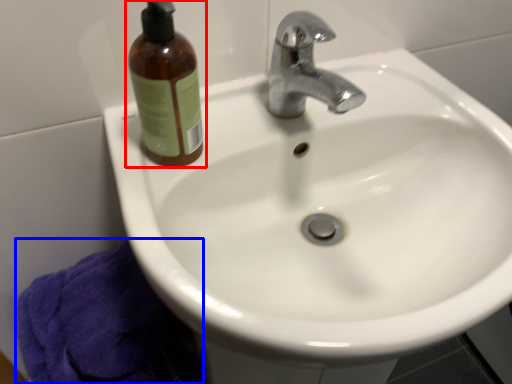
Question: Which object is further to the camera taking this photo, bottle (highlighted by a red box) or bath towel (highlighted by a blue box)?

Choices:
 (A) bottle
 (B) bath towel

Answer: (B)